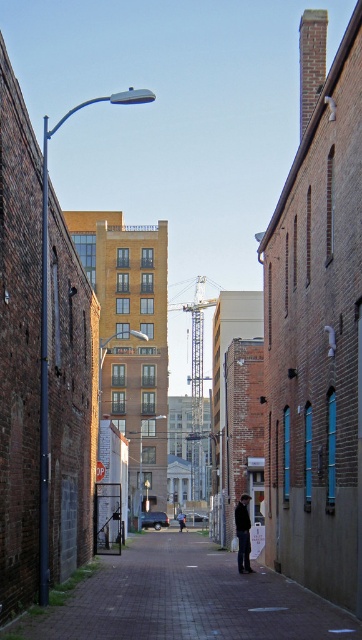
You are standing in the alleyway and notice a specific point marked at coordinates (x=18, y=344). Which object in the alley does this point belong to?

The point at coordinates (x=18, y=344) is located on the metallic pole at left.

You are a delivery drone flying above the alleyway. You need to land precisely at the point labeled as point [18,344]. Based on the scene, where exactly is this point located?

The point [18,344] is located on the metallic pole at left, which is part of the streetlamp on the left side of the alleyway.

You are a delivery person carrying a large package that is 1.5 meters tall. You need to walk through the alley and pass between the metallic pole at left and the dark brown leather jacket at center. Will the package fit vertically through the space between them?

The metallic pole at left is much taller than the dark brown leather jacket at center, so the space between them may not be tall enough for a 1.5 meter tall package. The package might not fit vertically if the lower part of the pole or the jacket obstructs the height.